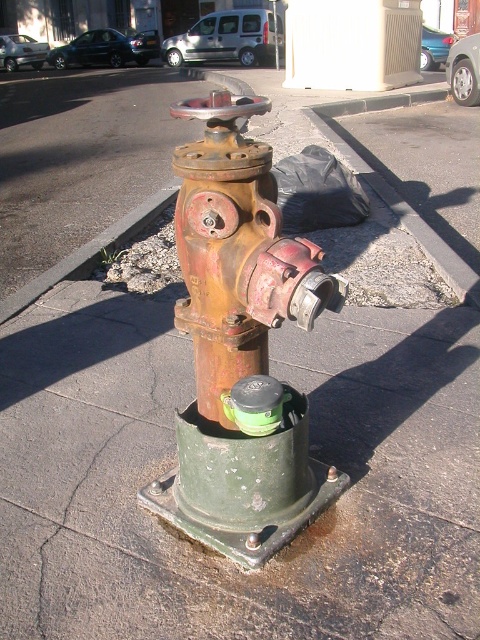
You are standing at the point with coordinates point (29, 289) and want to walk to the point (285, 308). According to the scene, which direction should you move to reach your destination?

You should move forward because point (285, 308) is in front of point (29, 289).

You are a delivery person with a 2.5 meter wide truck. You need to park your truck between the rusty metal hydrant at center and the rusty metal curb at lower left. Is there enough space for your truck?

The distance between the rusty metal hydrant at center and the rusty metal curb at lower left is 2.59 meters. Since your truck is 2.5 meters wide, there is enough space for your truck to park between them as the available space is slightly larger than the truck width.

You are a city inspector checking the sidewalk. You see the rusty metal hydrant at center and the rusty metal curb at lower left. Which object has a smaller width?

The rusty metal hydrant at center is thinner than the rusty metal curb at lower left, so the rusty metal hydrant at center has a smaller width.